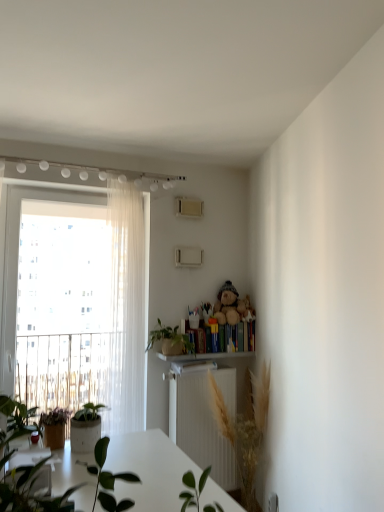
Describe the element at coordinates (76, 302) in the screenshot. I see `transparent glass window at left` at that location.

Find the location of a particular element. fuzzy brown teddy bear at upper center is located at coordinates (232, 306).

Where is `green leafy plant at center, the 2th houseplant viewed from the top`? Image resolution: width=384 pixels, height=512 pixels. green leafy plant at center, the 2th houseplant viewed from the top is located at coordinates (245, 429).

In terms of size, does transparent glass window at left appear bigger or smaller than sheer white curtain at left?

Clearly, transparent glass window at left is larger in size than sheer white curtain at left.

Where is `curtain on the right of transparent glass window at left`? This screenshot has width=384, height=512. curtain on the right of transparent glass window at left is located at coordinates (126, 306).

Which is more distant, (93, 242) or (109, 313)?

Point (93, 242)

Between transparent glass window at left and sheer white curtain at left, which one is positioned in front?

sheer white curtain at left.

Is green matte plant at center, which is the 1th houseplant in top-to-bottom order, shorter than hardcover books at right?

In fact, green matte plant at center, which is the 1th houseplant in top-to-bottom order, may be taller than hardcover books at right.

Is green matte plant at center, which is the 1th houseplant in top-to-bottom order, facing towards hardcover books at right?

No, green matte plant at center, which is the 1th houseplant in top-to-bottom order, is not oriented towards hardcover books at right.

I want to click on book that appears below the green matte plant at center, which is the 1th houseplant in top-to-bottom order (from a real-world perspective), so click(x=200, y=338).

From a real-world perspective, is fuzzy brown teddy bear at upper center positioned under white wooden shelf at center based on gravity?

No, from a real-world perspective, fuzzy brown teddy bear at upper center is not beneath white wooden shelf at center.

In the scene shown: Is white wooden shelf at center a part of fuzzy brown teddy bear at upper center?

No, white wooden shelf at center is not surrounded by fuzzy brown teddy bear at upper center.

Find the location of a particular element. The height and width of the screenshot is (512, 384). teddy on the right of white wooden shelf at center is located at coordinates (232, 306).

Is white wooden shelf at center not near fuzzy brown teddy bear at upper center?

No, white wooden shelf at center is not far away from fuzzy brown teddy bear at upper center.

Visually, is white wooden shelf at center positioned to the left or to the right of fuzzy brown teddy bear at upper center?

In the image, white wooden shelf at center appears on the left side of fuzzy brown teddy bear at upper center.

Is point (223, 354) positioned behind point (243, 300)?

No, it is not.

Who is shorter, white wooden shelf at center or fuzzy brown teddy bear at upper center?

white wooden shelf at center is shorter.

Is sheer white curtain at left spatially inside transparent glass window at left, or outside of it?

sheer white curtain at left is not inside transparent glass window at left, it's outside.

Is point (125, 425) less distant than point (51, 192)?

Yes, it is in front of point (51, 192).

Which object is wider, white wooden shelf at center or transparent glass window at left?

Wider between the two is white wooden shelf at center.

Is white wooden shelf at center oriented away from transparent glass window at left?

No, white wooden shelf at center's orientation is not away from transparent glass window at left.

From a real-world perspective, is white wooden shelf at center positioned above or below transparent glass window at left?

Clearly, from a real-world perspective, white wooden shelf at center is below transparent glass window at left.

Is there a large distance between white wooden shelf at center and transparent glass window at left?

Actually, white wooden shelf at center and transparent glass window at left are a little close together.

Is white wooden shelf at center not within green matte plant at center, which is the 1th houseplant in top-to-bottom order?

Absolutely, white wooden shelf at center is external to green matte plant at center, which is the 1th houseplant in top-to-bottom order.

How distant is white wooden shelf at center from green matte plant at center, which is the 1th houseplant in top-to-bottom order?

white wooden shelf at center is 5.01 inches from green matte plant at center, which is the 1th houseplant in top-to-bottom order.

Is white wooden shelf at center far from green matte plant at center, which is the 1th houseplant in top-to-bottom order?

They are positioned close to each other.

Between white wooden shelf at center and green matte plant at center, which is the 1th houseplant in top-to-bottom order, which one has smaller size?

Smaller between the two is white wooden shelf at center.

At what (x,y) coordinates should I click in order to perform the action: click on curtain below the transparent glass window at left (from the image's perspective). Please return your answer as a coordinate pair (x, y). The image size is (384, 512). Looking at the image, I should click on (126, 306).

In the image, there is a hardcover books at right. Identify the location of houseplant above it (from the image's perspective). This screenshot has height=512, width=384. (170, 340).

Based on their spatial positions, is sheer white curtain at left or white wooden shelf at center closer to transparent glass window at left?

sheer white curtain at left.

Estimate the real-world distances between objects in this image. Which object is closer to hardcover books at right, green leafy plant at center, which is counted as the first houseplant, starting from the bottom, or white wooden shelf at center?

Based on the image, white wooden shelf at center appears to be nearer to hardcover books at right.

Which object lies further to the anchor point transparent glass window at left, green matte plant at center, which is the 1th houseplant in top-to-bottom order, or green leafy plant at center, the 2th houseplant viewed from the top?

Among the two, green leafy plant at center, the 2th houseplant viewed from the top, is located further to transparent glass window at left.

Looking at the image, which one is located further to green leafy plant at center, the 2th houseplant viewed from the top, green matte plant at center, the 2th houseplant from the bottom, or white wooden shelf at center?

Based on the image, green matte plant at center, the 2th houseplant from the bottom, appears to be further to green leafy plant at center, the 2th houseplant viewed from the top.

Which object lies further to the anchor point transparent glass window at left, sheer white curtain at left or hardcover books at right?

hardcover books at right.

In the scene shown: From the image, which object appears to be nearer to green matte plant at center, the 2th houseplant from the bottom, green leafy plant at center, the 2th houseplant viewed from the top, or white wooden shelf at center?

white wooden shelf at center is positioned closer to the anchor green matte plant at center, the 2th houseplant from the bottom.

Considering their positions, is green matte plant at center, the 2th houseplant from the bottom, positioned closer to fuzzy brown teddy bear at upper center than transparent glass window at left?

Based on the image, green matte plant at center, the 2th houseplant from the bottom, appears to be nearer to fuzzy brown teddy bear at upper center.

Looking at the image, which one is located closer to fuzzy brown teddy bear at upper center, sheer white curtain at left or green matte plant at center, which is the 1th houseplant in top-to-bottom order?

green matte plant at center, which is the 1th houseplant in top-to-bottom order, is closer to fuzzy brown teddy bear at upper center.

The height and width of the screenshot is (512, 384). In order to click on curtain situated between transparent glass window at left and green matte plant at center, the 2th houseplant from the bottom, from left to right in this screenshot , I will do `click(126, 306)`.

Find the location of `shelf situated between sheer white curtain at left and fuzzy brown teddy bear at upper center from left to right`. shelf situated between sheer white curtain at left and fuzzy brown teddy bear at upper center from left to right is located at coordinates (204, 356).

Locate an element on the screen. Image resolution: width=384 pixels, height=512 pixels. shelf between sheer white curtain at left and hardcover books at right from left to right is located at coordinates (204, 356).

Find the location of `book situated between green matte plant at center, which is the 1th houseplant in top-to-bottom order, and fuzzy brown teddy bear at upper center from left to right`. book situated between green matte plant at center, which is the 1th houseplant in top-to-bottom order, and fuzzy brown teddy bear at upper center from left to right is located at coordinates (200, 338).